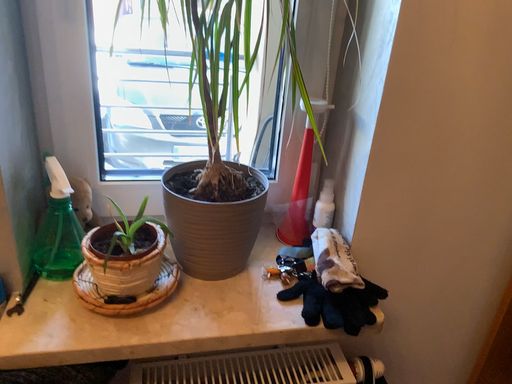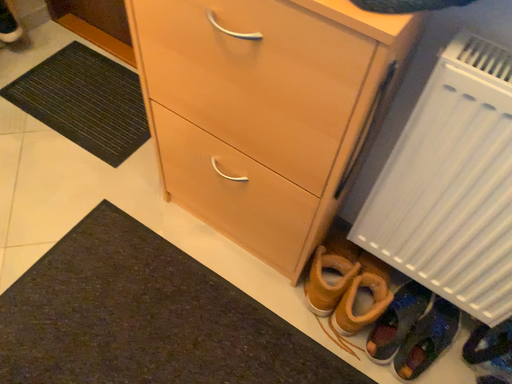
Question: Which way did the camera rotate in the video?

Choices:
 (A) rotated right
 (B) rotated left

Answer: (B)